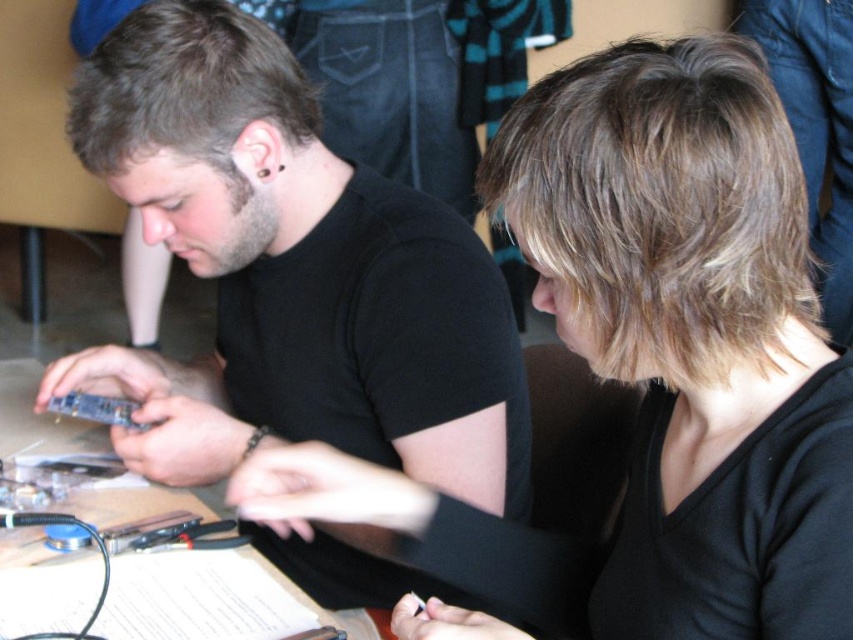
Based on the photo, you are standing in front of the table where the two people are working. You want to pick up the item located at point (634, 596) and the item at point (248, 368). Which item will require you to reach further away from your current position?

The item at point (248, 368) will require you to reach further away because it is farther from the camera compared to the item at point (634, 596).

You are standing at the point labeled point (119, 417) and want to reach the point labeled point (711, 560). Which direction should you move?

You should move forward because point (711, 560) is in front of point (119, 417).

You are standing in front of the table where the two individuals are working. There is a specific point at coordinates point [691,214] on the table. If you want to place a 24 inch ruler on the table so that one end touches this point, will the ruler extend beyond the edge of the table?

The distance from point [691,214] to the viewer is 23.45 inches. Since the ruler is 24 inches long, placing it so one end touches the point would mean the other end extends 0.55 inches beyond the table edge.